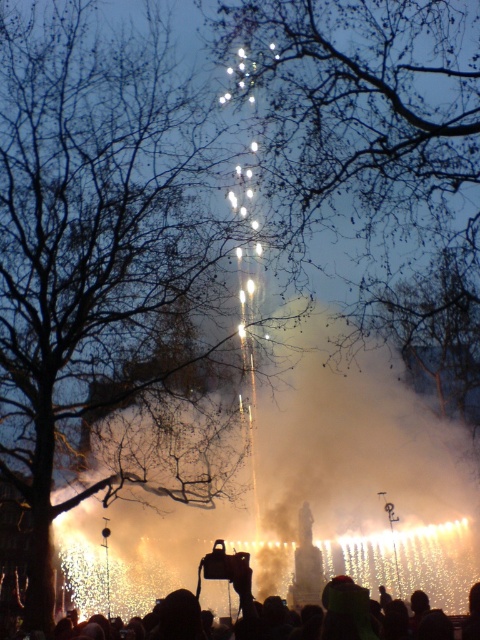
You are standing in the center of the scene and want to take a photo of the bare branches at center. To avoid including the fountain or water feature in your photo, which direction should you move? Please provide your answer in terms of compass directions like north, south, east, west, northeast, etc.

The bare branches at center are located at point [115,273]. Since the fountain is in the center of the image, moving north would take you away from the fountain towards the branches.

You are an event planner trying to estimate the space needed for a new attraction. The attraction requires an area that must be larger than the silhouette crowd at lower center. Can the space occupied by the bare branches at center accommodate this requirement?

The bare branches at center is larger in size than the silhouette crowd at lower center, so yes, the space occupied by the bare branches at center can accommodate the requirement since it is bigger than the silhouette crowd at lower center.

You are a photographer trying to capture the silhouette crowd at lower center without the bare branches at center blocking the view. Is it possible to do so given their heights?

The bare branches at center are taller than the silhouette crowd at lower center, so they might block the view. To avoid obstruction, position yourself lower or move closer to the crowd to frame the shot under the branches.